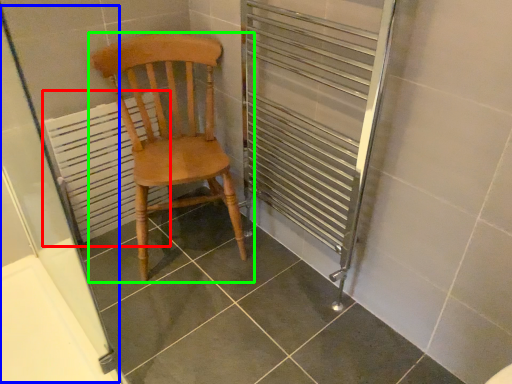
Question: Considering the real-world distances, which object is closest to radiator (highlighted by a red box)? screen door (highlighted by a blue box) or chair (highlighted by a green box).

Choices:
 (A) screen door
 (B) chair

Answer: (A)